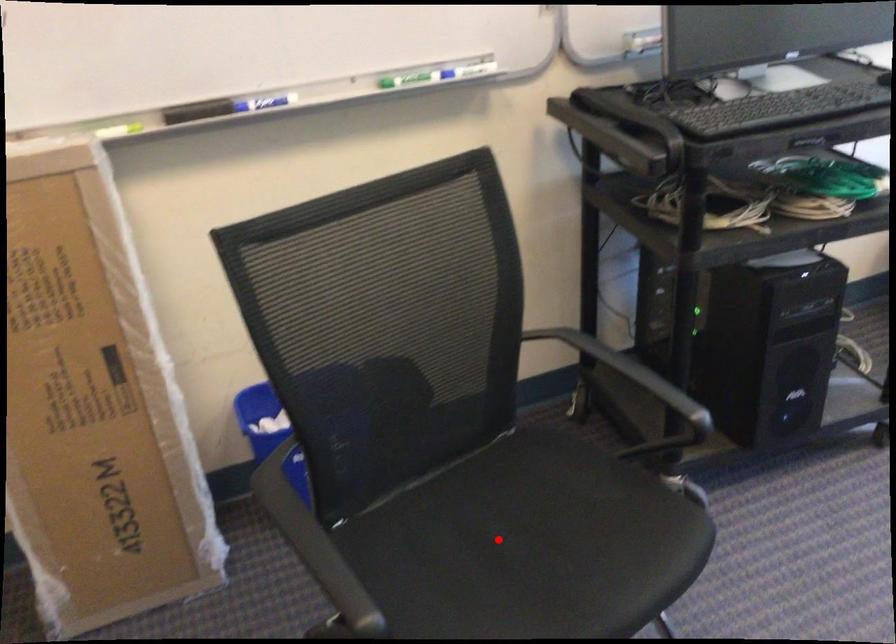
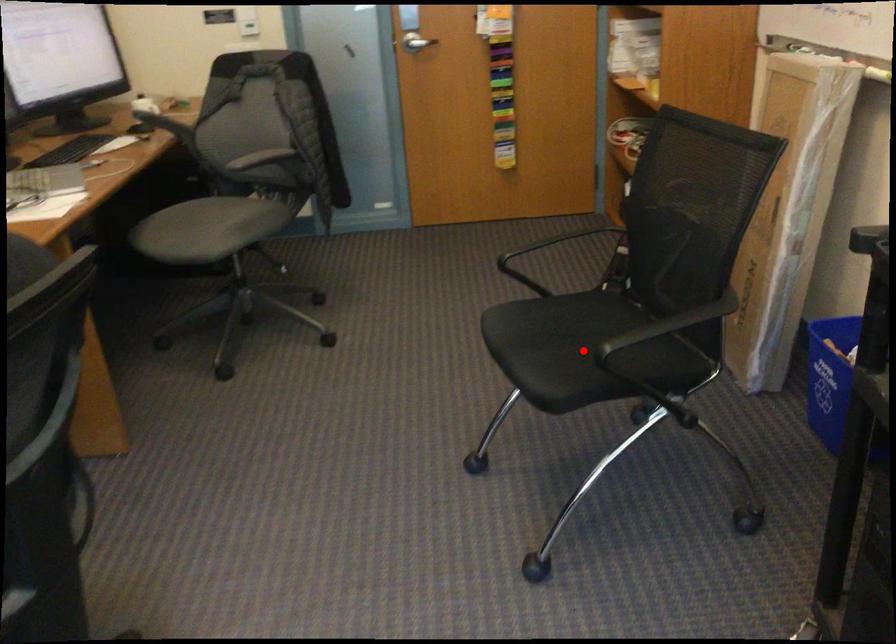
I am providing you with two images of the same scene from different viewpoints. A red point is marked on the first image and another point is marked on the second image. Is the red point in image1 aligned with the point shown in image2?

Yes